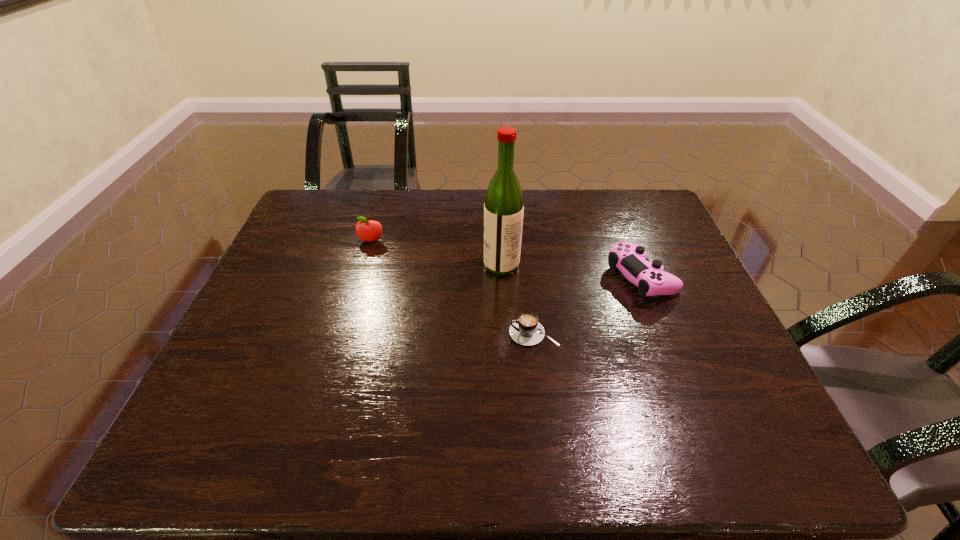
Identify which object is the third nearest to the tallest object. Please provide its 2D coordinates. Your answer should be formatted as a tuple, i.e. [(x, y)], where the tuple contains the x and y coordinates of a point satisfying the conditions above.

[(368, 230)]

The width and height of the screenshot is (960, 540). What are the coordinates of `object that can be found as the closest to the apple` in the screenshot? It's located at (504, 203).

This screenshot has height=540, width=960. Find the location of `free spot that satisfies the following two spatial constraints: 1. on the label of the control; 2. on the left side of the liquor`. free spot that satisfies the following two spatial constraints: 1. on the label of the control; 2. on the left side of the liquor is located at coordinates (502, 277).

You are a GUI agent. You are given a task and a screenshot of the screen. Output one action in this format:
    pyautogui.click(x=<x>, y=<y>)
    Task: Click on the vacant space that satisfies the following two spatial constraints: 1. on the label of the tallest object; 2. on the left side of the control
    
    Given the screenshot: What is the action you would take?
    pyautogui.click(x=502, y=277)

You are a GUI agent. You are given a task and a screenshot of the screen. Output one action in this format:
    pyautogui.click(x=<x>, y=<y>)
    Task: Click on the vacant position in the image that satisfies the following two spatial constraints: 1. on the back side of the third tallest object; 2. on the label of the liquor
    
    Given the screenshot: What is the action you would take?
    point(636,265)

This screenshot has height=540, width=960. Find the location of `free space that satisfies the following two spatial constraints: 1. on the front side of the rightmost object; 2. with the handle on the side of the shortest object`. free space that satisfies the following two spatial constraints: 1. on the front side of the rightmost object; 2. with the handle on the side of the shortest object is located at coordinates (663, 333).

Identify the location of vacant region that satisfies the following two spatial constraints: 1. on the label of the tallest object; 2. on the left side of the control. The width and height of the screenshot is (960, 540). (502, 277).